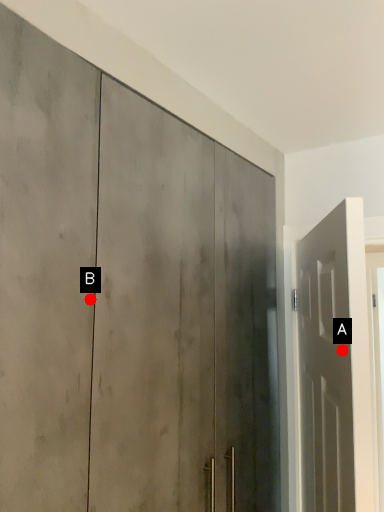
Question: Two points are circled on the image, labeled by A and B beside each circle. Which point is closer to the camera?

Choices:
 (A) A is closer
 (B) B is closer

Answer: (B)